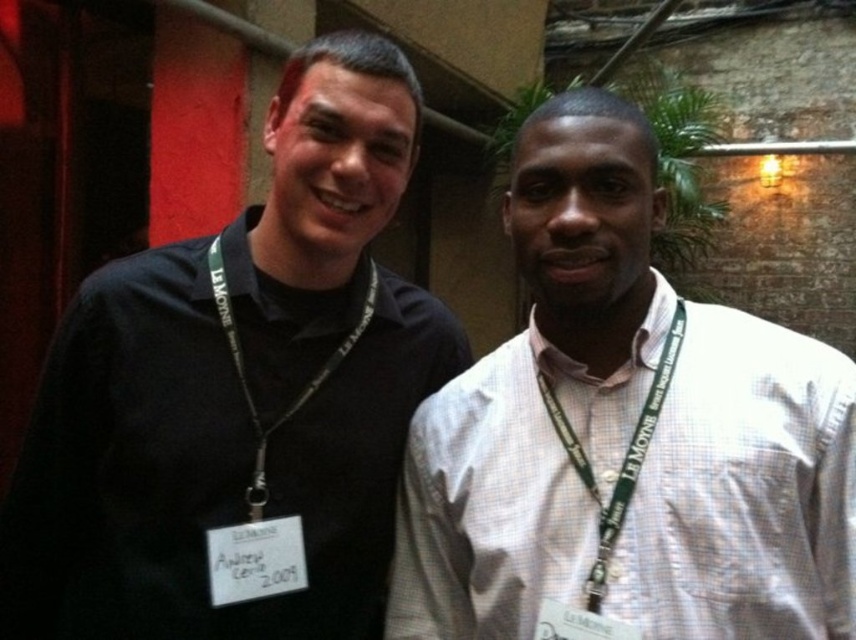
Question: Based on their relative distances, which object is nearer to the white checkered shirt at right?

Choices:
 (A) green fabric lanyard at center
 (B) black fabric lanyard at left
 (C) black matte shirt at left

Answer: (A)

Question: Observing the image, what is the correct spatial positioning of black matte shirt at left in reference to white checkered shirt at right?

Choices:
 (A) right
 (B) left

Answer: (B)

Question: Is black matte shirt at left positioned before black fabric lanyard at left?

Choices:
 (A) yes
 (B) no

Answer: (A)

Question: Which point is farther to the camera?

Choices:
 (A) white checkered shirt at right
 (B) black fabric lanyard at left
 (C) black matte shirt at left
 (D) green fabric lanyard at center

Answer: (B)

Question: Which point is closer to the camera taking this photo?

Choices:
 (A) (314, 74)
 (B) (639, 516)
 (C) (684, 328)

Answer: (B)

Question: Is black matte shirt at left to the right of white checkered shirt at right from the viewer's perspective?

Choices:
 (A) no
 (B) yes

Answer: (A)